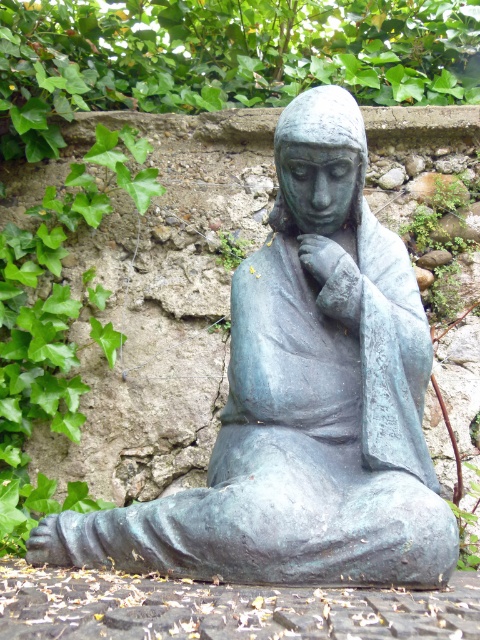
Is bronze statue at center bigger than bronze textured hand at center?

Indeed, bronze statue at center has a larger size compared to bronze textured hand at center.

Who is higher up, bronze statue at center or bronze textured hand at center?

bronze textured hand at center is higher up.

In order to click on bronze statue at center in this screenshot , I will do `click(302, 403)`.

Identify the location of bronze statue at center. Image resolution: width=480 pixels, height=640 pixels. pyautogui.click(x=302, y=403).